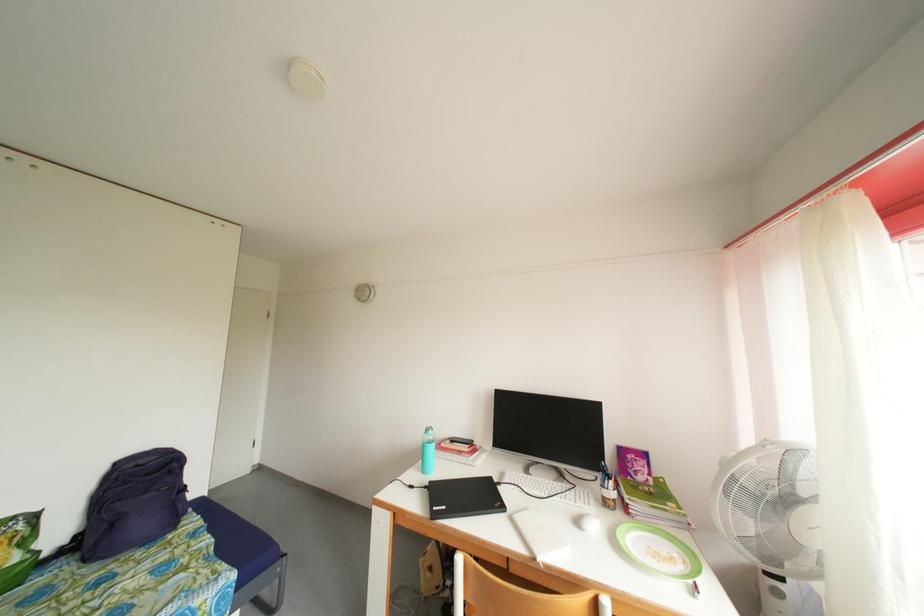
Find where to grasp the white computer mouse. Please return your answer as a coordinate pair (x, y).

(590, 524)